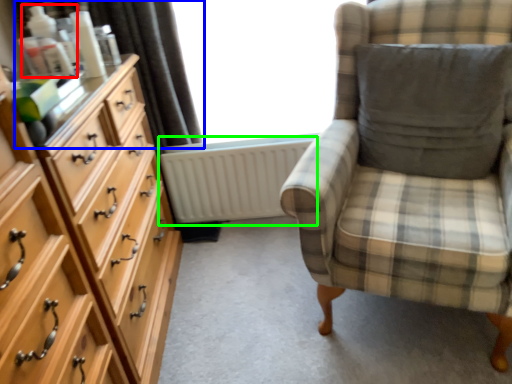
Question: Which object is positioned farthest from toiletry (highlighted by a red box)? Select from curtain (highlighted by a blue box) and radiator (highlighted by a green box).

Choices:
 (A) curtain
 (B) radiator

Answer: (B)